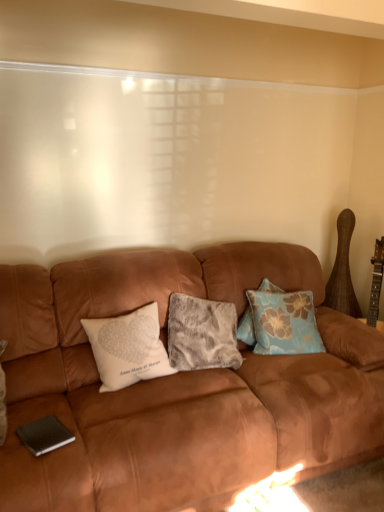
Find the location of `white printed pillow at center, the third pillow when ordered from right to left`. white printed pillow at center, the third pillow when ordered from right to left is located at coordinates (128, 348).

The height and width of the screenshot is (512, 384). Identify the location of blue floral fabric pillow at center, which is counted as the 1th pillow, starting from the right. (284, 322).

From a real-world perspective, which is physically above, white printed pillow at center, the third pillow when ordered from right to left, or blue floral fabric pillow at center, which is counted as the third pillow, starting from the left?

white printed pillow at center, the third pillow when ordered from right to left.

Looking at this image, which point is more distant from viewer, (158, 372) or (264, 311)?

The point (264, 311) is behind.

Are white printed pillow at center, the third pillow when ordered from right to left, and blue floral fabric pillow at center, which is counted as the third pillow, starting from the left, far apart?

Actually, white printed pillow at center, the third pillow when ordered from right to left, and blue floral fabric pillow at center, which is counted as the third pillow, starting from the left, are a little close together.

In the scene shown: From a real-world perspective, is blue floral fabric pillow at center, which is counted as the third pillow, starting from the left, beneath white printed pillow at center, marked as the 1th pillow in a left-to-right arrangement?

Yes.

How different are the orientations of blue floral fabric pillow at center, which is counted as the 1th pillow, starting from the right, and white printed pillow at center, the third pillow when ordered from right to left, in degrees?

The facing directions of blue floral fabric pillow at center, which is counted as the 1th pillow, starting from the right, and white printed pillow at center, the third pillow when ordered from right to left, are 22.6 degrees apart.

Which of these two, blue floral fabric pillow at center, which is counted as the third pillow, starting from the left, or white printed pillow at center, marked as the 1th pillow in a left-to-right arrangement, stands taller?

With more height is blue floral fabric pillow at center, which is counted as the third pillow, starting from the left.

Is blue floral fabric pillow at center, which is counted as the 1th pillow, starting from the right, looking in the opposite direction of white printed pillow at center, the third pillow when ordered from right to left?

No, blue floral fabric pillow at center, which is counted as the 1th pillow, starting from the right, is not facing away from white printed pillow at center, the third pillow when ordered from right to left.

Considering the sizes of objects fuzzy gray pillow at center, which is counted as the second pillow, starting from the right, and blue floral fabric pillow at center, which is counted as the 1th pillow, starting from the right, in the image provided, who is smaller, fuzzy gray pillow at center, which is counted as the second pillow, starting from the right, or blue floral fabric pillow at center, which is counted as the 1th pillow, starting from the right,?

Smaller between the two is blue floral fabric pillow at center, which is counted as the 1th pillow, starting from the right.

Which of these two, fuzzy gray pillow at center, which is counted as the second pillow, starting from the right, or blue floral fabric pillow at center, which is counted as the 1th pillow, starting from the right, is thinner?

Thinner between the two is blue floral fabric pillow at center, which is counted as the 1th pillow, starting from the right.

Would you consider fuzzy gray pillow at center, which is counted as the second pillow, starting from the right, to be distant from blue floral fabric pillow at center, which is counted as the 1th pillow, starting from the right?

No, fuzzy gray pillow at center, which is counted as the second pillow, starting from the right, is in close proximity to blue floral fabric pillow at center, which is counted as the 1th pillow, starting from the right.

From a real-world perspective, which object stands above the other?

blue floral fabric pillow at center, which is counted as the third pillow, starting from the left, is physically above.

How many degrees apart are the facing directions of blue floral fabric pillow at center, which is counted as the third pillow, starting from the left, and fuzzy gray pillow at center, which is counted as the second pillow, starting from the right?

They differ by 3.11 degrees in their facing directions.

Considering the points (305, 330) and (184, 329), which point is in front, point (305, 330) or point (184, 329)?

Positioned in front is point (184, 329).

In order to click on pillow below the blue floral fabric pillow at center, which is counted as the 1th pillow, starting from the right (from a real-world perspective) in this screenshot , I will do `click(202, 334)`.

Is blue floral fabric pillow at center, which is counted as the third pillow, starting from the left, next to fuzzy gray pillow at center, which is counted as the second pillow, starting from the right?

No, blue floral fabric pillow at center, which is counted as the third pillow, starting from the left, is not next to fuzzy gray pillow at center, which is counted as the second pillow, starting from the right.

How distant is suede brown couch at center from fuzzy gray pillow at center, marked as the 2th pillow in a left-to-right arrangement?

They are 11.95 inches apart.

From the image's perspective, would you say suede brown couch at center is shown under fuzzy gray pillow at center, marked as the 2th pillow in a left-to-right arrangement?

Correct, suede brown couch at center appears lower than fuzzy gray pillow at center, marked as the 2th pillow in a left-to-right arrangement, in the image.

Does suede brown couch at center touch fuzzy gray pillow at center, which is counted as the second pillow, starting from the right?

suede brown couch at center is not next to fuzzy gray pillow at center, which is counted as the second pillow, starting from the right, and they're not touching.

Which of these two, suede brown couch at center or fuzzy gray pillow at center, which is counted as the second pillow, starting from the right, is bigger?

suede brown couch at center is bigger.

Considering the positions of objects white printed pillow at center, the third pillow when ordered from right to left, and fuzzy gray pillow at center, which is counted as the second pillow, starting from the right, in the image provided, who is behind, white printed pillow at center, the third pillow when ordered from right to left, or fuzzy gray pillow at center, which is counted as the second pillow, starting from the right,?

fuzzy gray pillow at center, which is counted as the second pillow, starting from the right, is further from the camera.

From a real-world perspective, relative to fuzzy gray pillow at center, marked as the 2th pillow in a left-to-right arrangement, is white printed pillow at center, the third pillow when ordered from right to left, vertically above or below?

white printed pillow at center, the third pillow when ordered from right to left, is above fuzzy gray pillow at center, marked as the 2th pillow in a left-to-right arrangement.

Does point (115, 321) come closer to viewer compared to point (227, 307)?

Yes, point (115, 321) is in front of point (227, 307).

Is white printed pillow at center, the third pillow when ordered from right to left, to the right of fuzzy gray pillow at center, marked as the 2th pillow in a left-to-right arrangement, from the viewer's perspective?

Incorrect, white printed pillow at center, the third pillow when ordered from right to left, is not on the right side of fuzzy gray pillow at center, marked as the 2th pillow in a left-to-right arrangement.

Considering the positions of point (33, 274) and point (159, 365), is point (33, 274) closer or farther from the camera than point (159, 365)?

Point (33, 274) appears to be farther away from the viewer than point (159, 365).

In terms of size, does suede brown couch at center appear bigger or smaller than white printed pillow at center, the third pillow when ordered from right to left?

In the image, suede brown couch at center appears to be larger than white printed pillow at center, the third pillow when ordered from right to left.

Can you confirm if suede brown couch at center is wider than white printed pillow at center, marked as the 1th pillow in a left-to-right arrangement?

Yes, suede brown couch at center is wider than white printed pillow at center, marked as the 1th pillow in a left-to-right arrangement.

Which is more to the left, suede brown couch at center or white printed pillow at center, the third pillow when ordered from right to left?

white printed pillow at center, the third pillow when ordered from right to left.

The width and height of the screenshot is (384, 512). Identify the location of pillow that is the 1st one below the white printed pillow at center, marked as the 1th pillow in a left-to-right arrangement (from a real-world perspective). (284, 322).

The width and height of the screenshot is (384, 512). In order to click on the 2nd pillow positioned above the white printed pillow at center, marked as the 1th pillow in a left-to-right arrangement (from the image's perspective) in this screenshot , I will do `click(284, 322)`.

When comparing their distances from fuzzy gray pillow at center, marked as the 2th pillow in a left-to-right arrangement, does blue floral fabric pillow at center, which is counted as the third pillow, starting from the left, or white printed pillow at center, the third pillow when ordered from right to left, seem further?

Among the two, blue floral fabric pillow at center, which is counted as the third pillow, starting from the left, is located further to fuzzy gray pillow at center, marked as the 2th pillow in a left-to-right arrangement.

When comparing their distances from suede brown couch at center, does white printed pillow at center, marked as the 1th pillow in a left-to-right arrangement, or fuzzy gray pillow at center, which is counted as the second pillow, starting from the right, seem closer?

fuzzy gray pillow at center, which is counted as the second pillow, starting from the right, is closer to suede brown couch at center.

Which object lies further to the anchor point fuzzy gray pillow at center, which is counted as the second pillow, starting from the right, white printed pillow at center, marked as the 1th pillow in a left-to-right arrangement, or suede brown couch at center?

The object further to fuzzy gray pillow at center, which is counted as the second pillow, starting from the right, is suede brown couch at center.

Consider the image. From the image, which object appears to be nearer to suede brown couch at center, fuzzy gray pillow at center, marked as the 2th pillow in a left-to-right arrangement, or blue floral fabric pillow at center, which is counted as the 1th pillow, starting from the right?

fuzzy gray pillow at center, marked as the 2th pillow in a left-to-right arrangement, is closer to suede brown couch at center.

Estimate the real-world distances between objects in this image. Which object is closer to blue floral fabric pillow at center, which is counted as the 1th pillow, starting from the right, fuzzy gray pillow at center, which is counted as the second pillow, starting from the right, or suede brown couch at center?

The object closer to blue floral fabric pillow at center, which is counted as the 1th pillow, starting from the right, is fuzzy gray pillow at center, which is counted as the second pillow, starting from the right.

When comparing their distances from blue floral fabric pillow at center, which is counted as the 1th pillow, starting from the right, does white printed pillow at center, the third pillow when ordered from right to left, or suede brown couch at center seem closer?

suede brown couch at center lies closer to blue floral fabric pillow at center, which is counted as the 1th pillow, starting from the right, than the other object.

Based on their spatial positions, is blue floral fabric pillow at center, which is counted as the third pillow, starting from the left, or suede brown couch at center further from fuzzy gray pillow at center, marked as the 2th pillow in a left-to-right arrangement?

Among the two, suede brown couch at center is located further to fuzzy gray pillow at center, marked as the 2th pillow in a left-to-right arrangement.

Looking at the image, which one is located further to white printed pillow at center, marked as the 1th pillow in a left-to-right arrangement, suede brown couch at center or blue floral fabric pillow at center, which is counted as the third pillow, starting from the left?

blue floral fabric pillow at center, which is counted as the third pillow, starting from the left, is positioned further to the anchor white printed pillow at center, marked as the 1th pillow in a left-to-right arrangement.

I want to click on pillow between white printed pillow at center, the third pillow when ordered from right to left, and blue floral fabric pillow at center, which is counted as the third pillow, starting from the left, so click(x=202, y=334).

Where is `pillow located between suede brown couch at center and fuzzy gray pillow at center, marked as the 2th pillow in a left-to-right arrangement, in the depth direction`? The width and height of the screenshot is (384, 512). pillow located between suede brown couch at center and fuzzy gray pillow at center, marked as the 2th pillow in a left-to-right arrangement, in the depth direction is located at coordinates (128, 348).